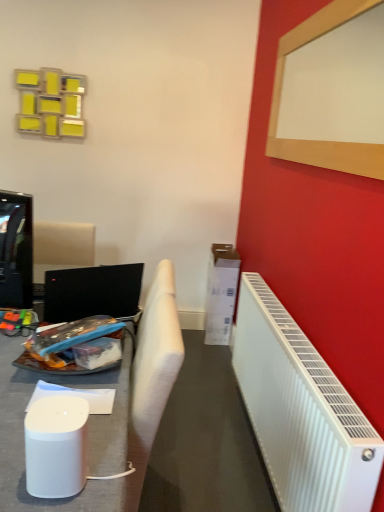
Question: Considering the relative sizes of white fabric chair at left and white plastic radiator at right in the image provided, is white fabric chair at left bigger than white plastic radiator at right?

Choices:
 (A) yes
 (B) no

Answer: (A)

Question: Can you confirm if white fabric chair at left is smaller than white plastic radiator at right?

Choices:
 (A) no
 (B) yes

Answer: (A)

Question: Can you confirm if white fabric chair at left is shorter than white plastic radiator at right?

Choices:
 (A) no
 (B) yes

Answer: (A)

Question: Is white fabric chair at left oriented towards white plastic radiator at right?

Choices:
 (A) yes
 (B) no

Answer: (B)

Question: Does white fabric chair at left come in front of white plastic radiator at right?

Choices:
 (A) yes
 (B) no

Answer: (B)

Question: Considering the relative sizes of white fabric chair at left and white plastic radiator at right in the image provided, is white fabric chair at left thinner than white plastic radiator at right?

Choices:
 (A) yes
 (B) no

Answer: (B)

Question: Is wooden frame at upper right at the right side of white plastic radiator at right?

Choices:
 (A) yes
 (B) no

Answer: (A)

Question: Does wooden frame at upper right have a larger size compared to white plastic radiator at right?

Choices:
 (A) yes
 (B) no

Answer: (B)

Question: Would you say wooden frame at upper right is outside white plastic radiator at right?

Choices:
 (A) no
 (B) yes

Answer: (B)

Question: Is wooden frame at upper right not near white plastic radiator at right?

Choices:
 (A) no
 (B) yes

Answer: (B)

Question: Is wooden frame at upper right oriented towards white plastic radiator at right?

Choices:
 (A) yes
 (B) no

Answer: (B)

Question: Is wooden frame at upper right to the left of white plastic radiator at right from the viewer's perspective?

Choices:
 (A) no
 (B) yes

Answer: (A)

Question: Is black glossy television at left bigger than white fabric chair at left?

Choices:
 (A) yes
 (B) no

Answer: (B)